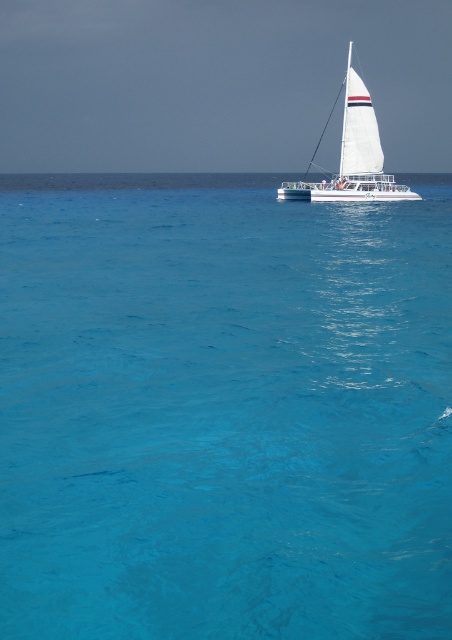
Describe the element at coordinates (222, 410) in the screenshot. I see `transparent blue water at center` at that location.

Between point (59, 296) and point (288, 195), which one is positioned behind?

Point (288, 195)

At what (x,y) coordinates should I click in order to perform the action: click on transparent blue water at center. Please return your answer as a coordinate pair (x, y). This screenshot has width=452, height=640. Looking at the image, I should click on (222, 410).